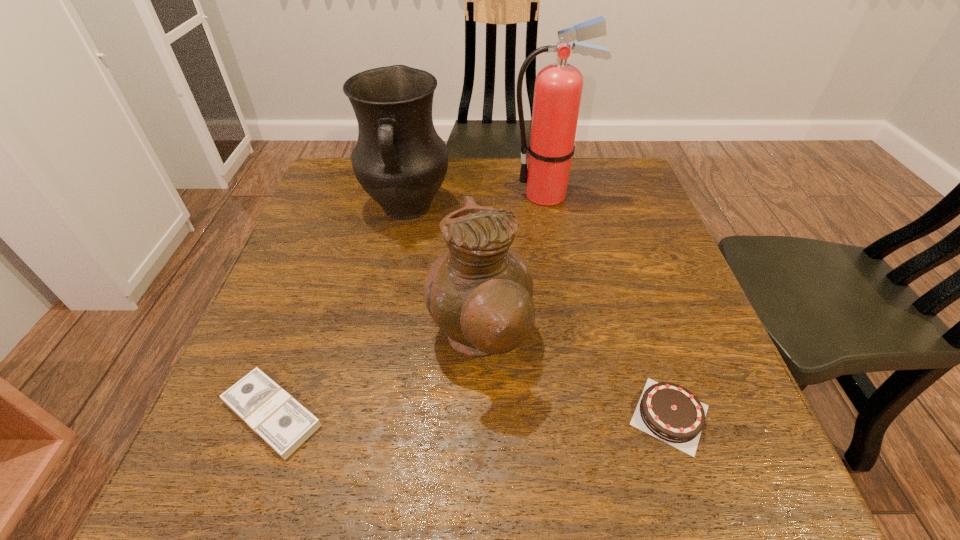
Locate an element on the screen. The width and height of the screenshot is (960, 540). free space that satisfies the following two spatial constraints: 1. at the spout of the second shortest object; 2. on the right side of the nearer pitcher is located at coordinates (478, 415).

The image size is (960, 540). I want to click on free space that satisfies the following two spatial constraints: 1. at the spout of the nearer pitcher; 2. on the right side of the second shortest object, so click(x=478, y=415).

Where is `vacant space that satisfies the following two spatial constraints: 1. at the spout of the nearer pitcher; 2. on the left side of the fourth tallest object`? Image resolution: width=960 pixels, height=540 pixels. vacant space that satisfies the following two spatial constraints: 1. at the spout of the nearer pitcher; 2. on the left side of the fourth tallest object is located at coordinates (478, 415).